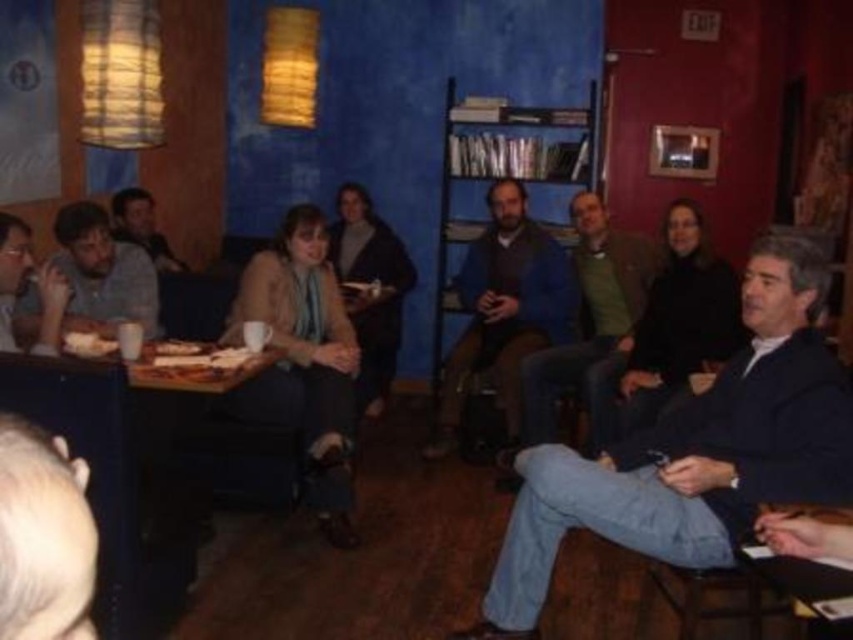
Question: Does dark blue suit at right appear under matte gray shirt at left?

Choices:
 (A) yes
 (B) no

Answer: (A)

Question: Which point is closer to the camera taking this photo?

Choices:
 (A) (173, 269)
 (B) (30, 301)
 (C) (166, 344)

Answer: (C)

Question: Can you confirm if dark blue suit at center is positioned to the right of matte gray shirt at left?

Choices:
 (A) no
 (B) yes

Answer: (B)

Question: Which object appears closest to the camera in this image?

Choices:
 (A) matte brown bread at lower left
 (B) matte gray sweater at upper left
 (C) matte gray shirt at left

Answer: (C)

Question: Which object is positioned farthest from the matte black jacket at left?

Choices:
 (A) matte gray sweater at upper left
 (B) dark blue suit at center

Answer: (B)

Question: Does matte brown bread at lower left have a larger size compared to white paper plate at center?

Choices:
 (A) no
 (B) yes

Answer: (B)